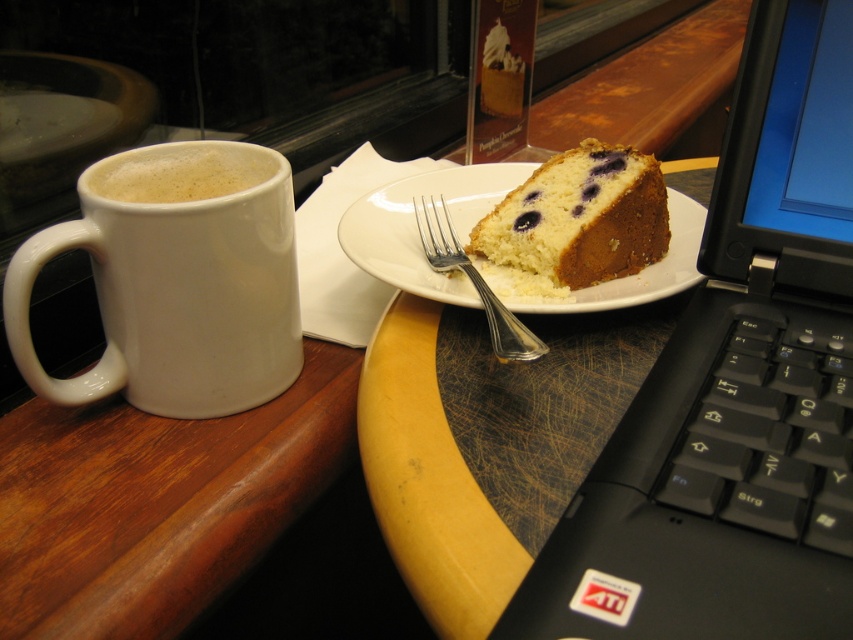
Question: Does yellow cake with blueberries at center appear under silver metallic fork at center?

Choices:
 (A) yes
 (B) no

Answer: (B)

Question: Observing the image, what is the correct spatial positioning of white ceramic plate at center in reference to white matte cup at left?

Choices:
 (A) below
 (B) above

Answer: (A)

Question: From the image, what is the correct spatial relationship of yellow cake with blueberries at center in relation to white matte cup at left?

Choices:
 (A) right
 (B) left

Answer: (A)

Question: Among these points, which one is farthest from the camera?

Choices:
 (A) (262, 157)
 (B) (821, 609)
 (C) (469, 172)
 (D) (132, 330)

Answer: (C)

Question: Which object is farther from the camera taking this photo?

Choices:
 (A) white matte cup at left
 (B) silver metallic fork at center
 (C) yellow cake with blueberries at center
 (D) white ceramic plate at center

Answer: (C)

Question: Which point is farther to the camera?

Choices:
 (A) black plastic laptop at right
 (B) silver metallic fork at center

Answer: (B)